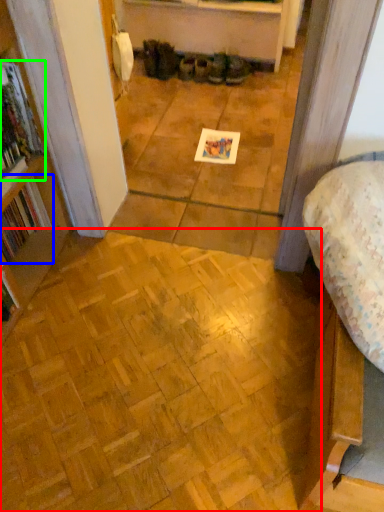
Question: Considering the real-world distances, which object is closest to plywood (highlighted by a red box)? book (highlighted by a blue box) or book (highlighted by a green box).

Choices:
 (A) book
 (B) book

Answer: (A)